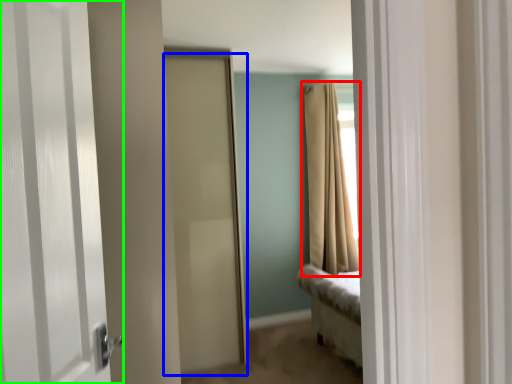
Question: Which object is the closest to the curtain (highlighted by a red box)? Choose among these: door (highlighted by a blue box) or door (highlighted by a green box).

Choices:
 (A) door
 (B) door

Answer: (A)